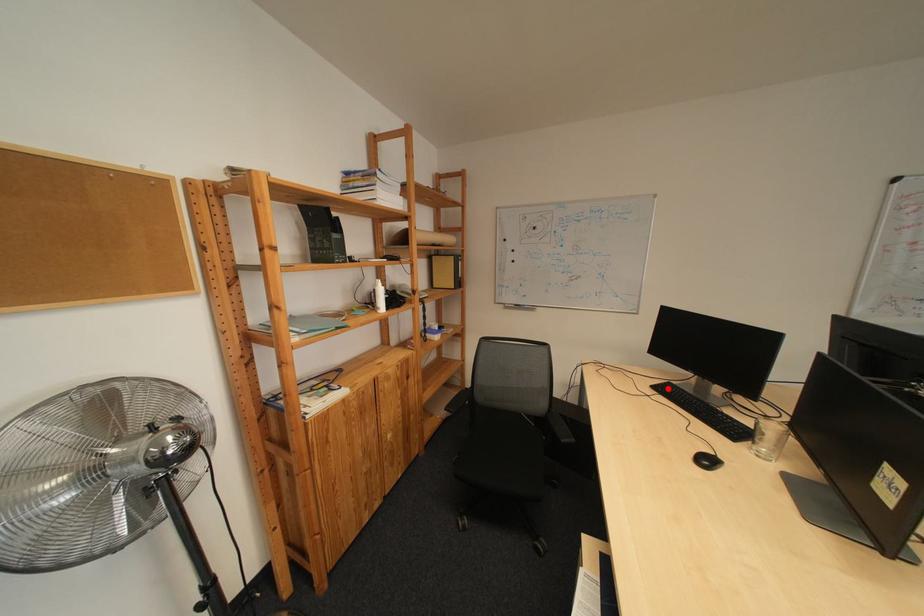
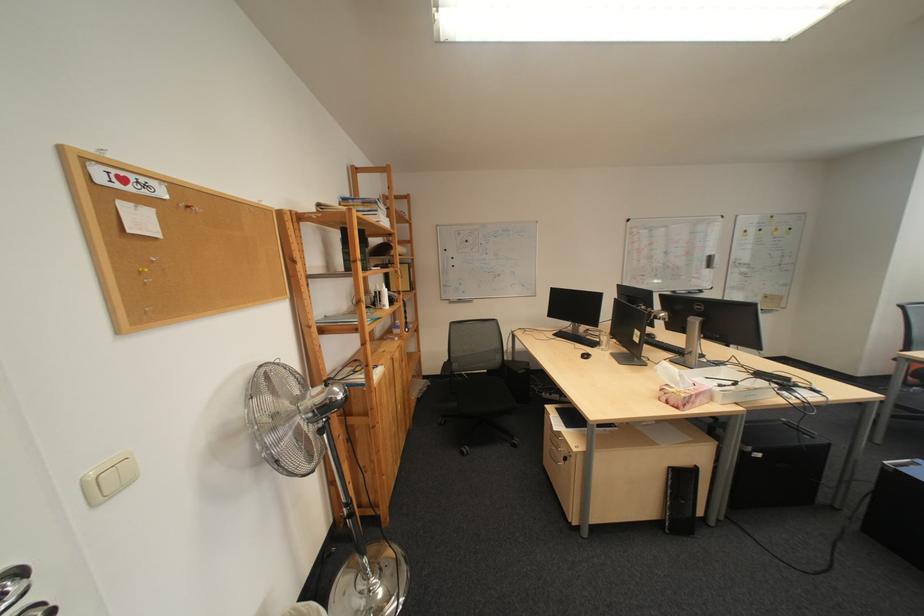
The point at the highlighted location is marked in the first image. Where is the corresponding point in the second image?

(568, 336)